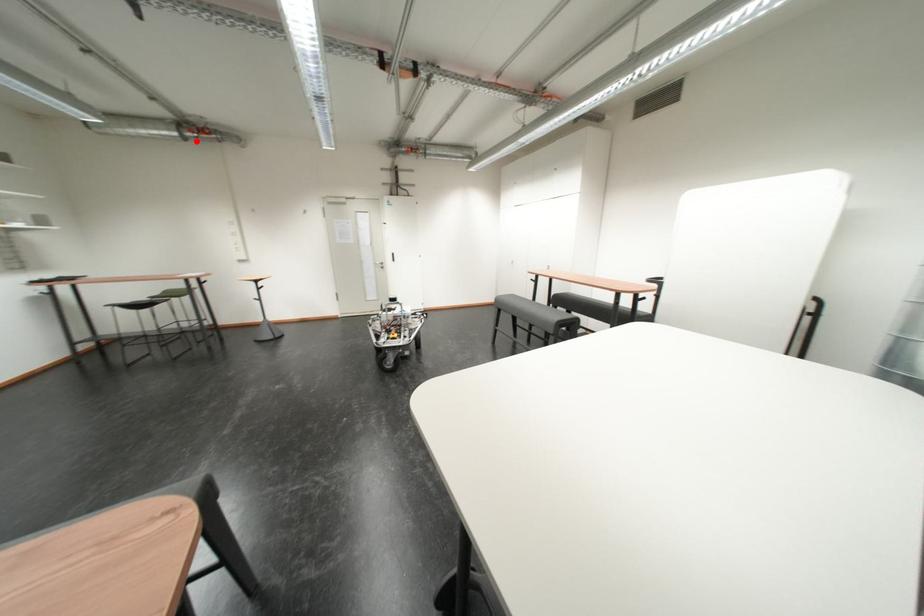
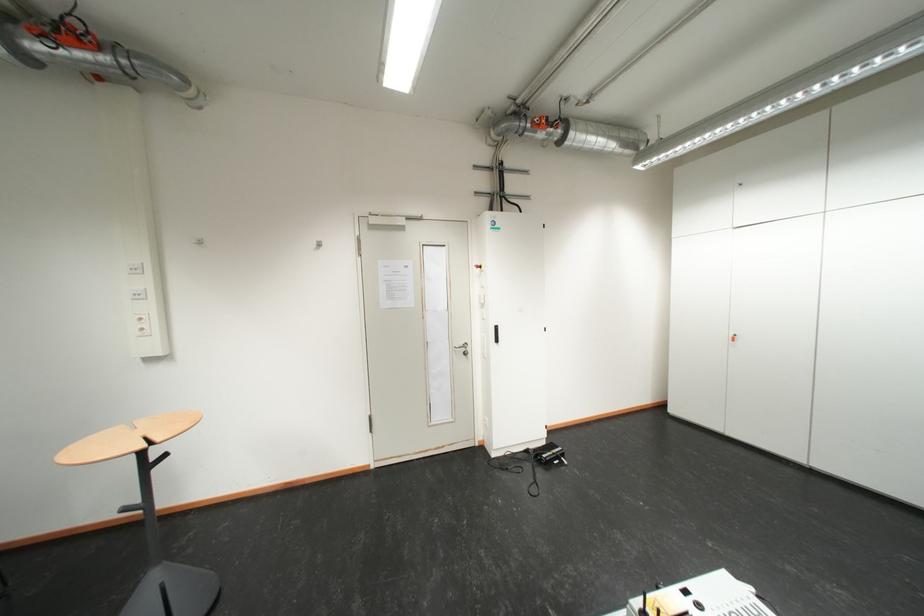
Where in the second image is the point corresponding to the highlighted location from the first image?

(35, 60)